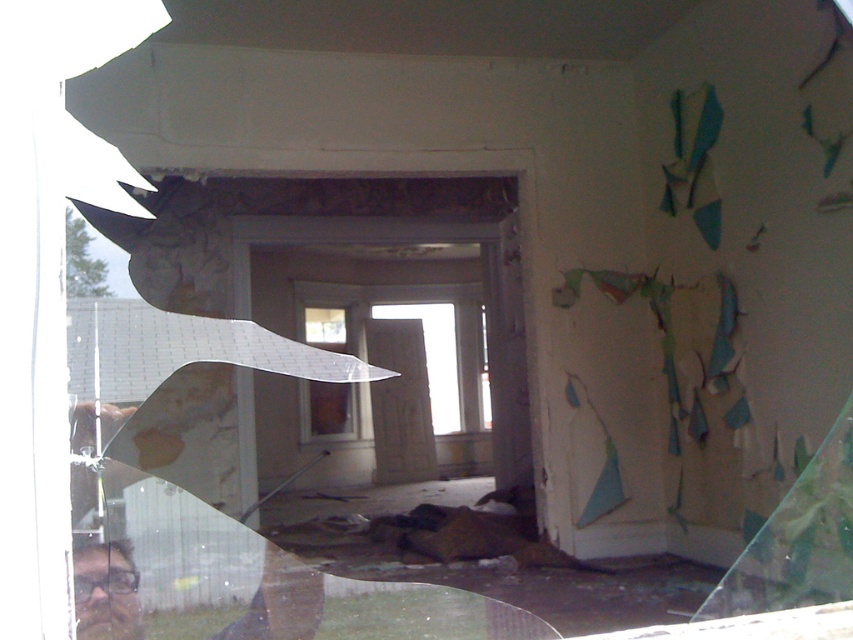
Consider the image. Between clear glass window at center and transparent glass window at center, which one appears on the left side from the viewer's perspective?

clear glass window at center

Is clear glass window at center bigger than transparent glass window at center?

Indeed, clear glass window at center has a larger size compared to transparent glass window at center.

Who is more distant from viewer, (x=334, y=400) or (x=486, y=426)?

The point (x=486, y=426) is behind.

Find the location of a particular element. This screenshot has height=640, width=853. clear glass window at center is located at coordinates (329, 408).